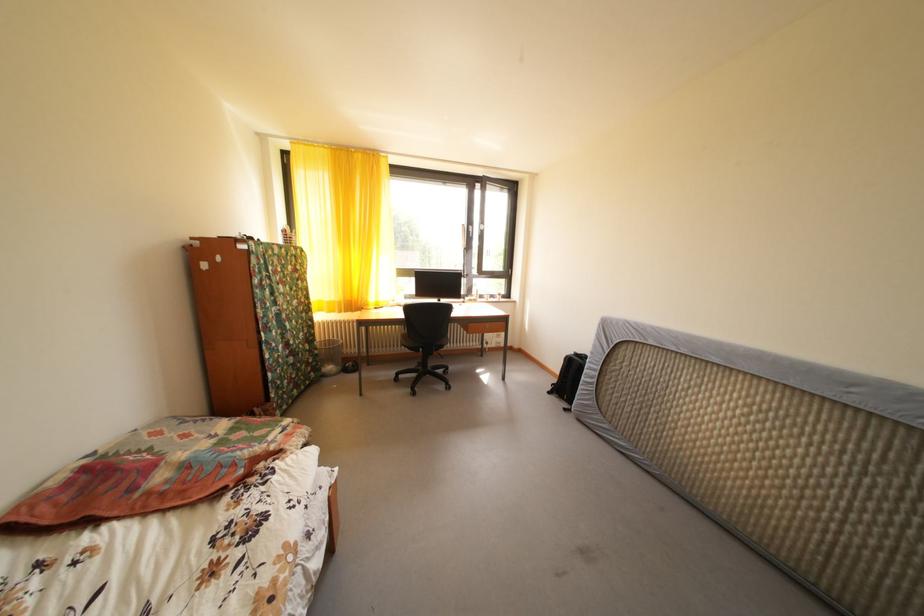
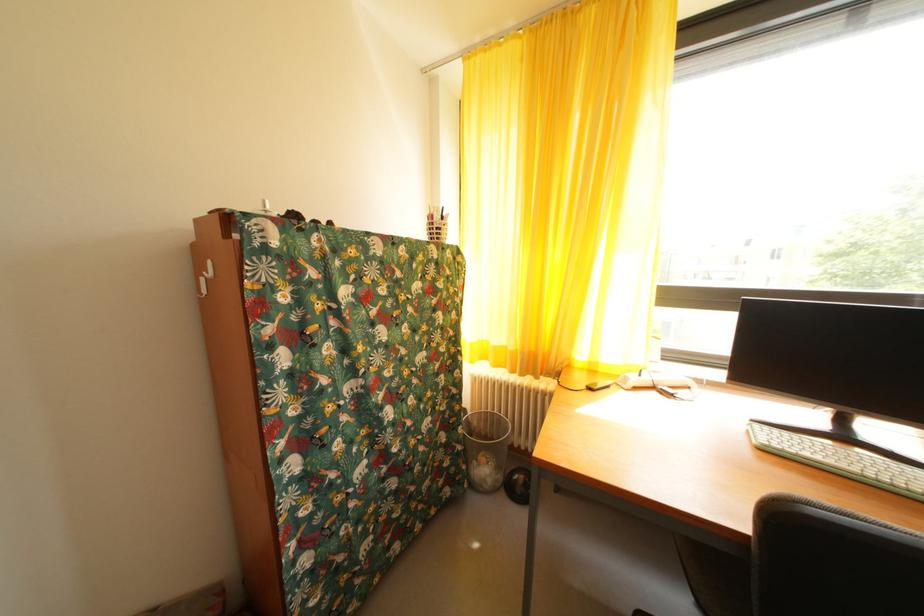
Locate, in the second image, the point that corresponds to (337,309) in the first image.

(505, 354)